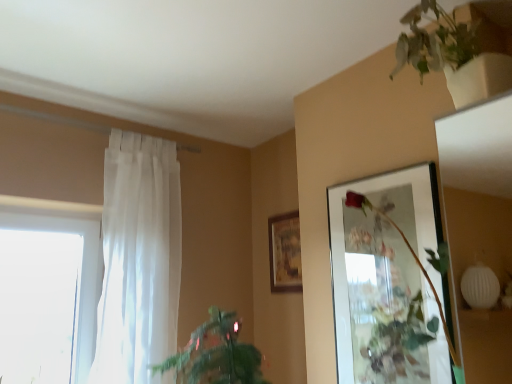
The height and width of the screenshot is (384, 512). What do you see at coordinates (452, 55) in the screenshot?
I see `green matte plant at upper right, which is the 2th houseplant from left to right` at bounding box center [452, 55].

What do you see at coordinates (389, 280) in the screenshot?
I see `matte glass picture frame at upper right, positioned as the 1th picture frame in front-to-back order` at bounding box center [389, 280].

Where is `green matte plant at upper right, which is the 2th houseplant from left to right`? The image size is (512, 384). green matte plant at upper right, which is the 2th houseplant from left to right is located at coordinates (452, 55).

Identify the location of houseplant below the wooden framed artwork at center, which is the 2th picture frame from right to left (from the image's perspective). This screenshot has height=384, width=512. (216, 354).

Considering the relative sizes of green leafy plant at lower left, which is the 1th houseplant from left to right, and wooden framed artwork at center, which is counted as the 2th picture frame, starting from the front, in the image provided, is green leafy plant at lower left, which is the 1th houseplant from left to right, thinner than wooden framed artwork at center, which is counted as the 2th picture frame, starting from the front,?

No.

Considering the relative positions of green leafy plant at lower left, which appears as the second houseplant when viewed from the right, and wooden framed artwork at center, which appears as the 1th picture frame when viewed from the left, in the image provided, is green leafy plant at lower left, which appears as the second houseplant when viewed from the right, to the right of wooden framed artwork at center, which appears as the 1th picture frame when viewed from the left, from the viewer's perspective?

In fact, green leafy plant at lower left, which appears as the second houseplant when viewed from the right, is to the left of wooden framed artwork at center, which appears as the 1th picture frame when viewed from the left.

In terms of width, does matte glass picture frame at upper right, the 2th picture frame in the back-to-front sequence, look wider or thinner when compared to green leafy plant at lower left, marked as the second houseplant in a top-to-bottom arrangement?

Considering their sizes, matte glass picture frame at upper right, the 2th picture frame in the back-to-front sequence, looks slimmer than green leafy plant at lower left, marked as the second houseplant in a top-to-bottom arrangement.

Looking at this image, between matte glass picture frame at upper right, positioned as the 1th picture frame in front-to-back order, and green leafy plant at lower left, which appears as the second houseplant when viewed from the right, which one has smaller size?

matte glass picture frame at upper right, positioned as the 1th picture frame in front-to-back order, is smaller.

Are matte glass picture frame at upper right, marked as the 1th picture frame in a right-to-left arrangement, and green leafy plant at lower left, positioned as the first houseplant in bottom-to-top order, located far from each other?

matte glass picture frame at upper right, marked as the 1th picture frame in a right-to-left arrangement, is near green leafy plant at lower left, positioned as the first houseplant in bottom-to-top order, not far away.

Considering the points (414, 208) and (277, 228), which point is in front, point (414, 208) or point (277, 228)?

The point (414, 208) is closer.

Is matte glass picture frame at upper right, marked as the 1th picture frame in a right-to-left arrangement, far away from wooden framed artwork at center, which is the 2th picture frame from right to left?

matte glass picture frame at upper right, marked as the 1th picture frame in a right-to-left arrangement, is actually quite close to wooden framed artwork at center, which is the 2th picture frame from right to left.

Would you say matte glass picture frame at upper right, marked as the 1th picture frame in a right-to-left arrangement, is inside or outside wooden framed artwork at center, which is the 2th picture frame from right to left?

matte glass picture frame at upper right, marked as the 1th picture frame in a right-to-left arrangement, lies outside wooden framed artwork at center, which is the 2th picture frame from right to left.

Between matte glass picture frame at upper right, marked as the 1th picture frame in a right-to-left arrangement, and wooden framed artwork at center, which appears as the 1th picture frame when viewed from the left, which one is positioned in front?

matte glass picture frame at upper right, marked as the 1th picture frame in a right-to-left arrangement, is in front.

Looking at their sizes, would you say green leafy plant at lower left, which appears as the second houseplant when viewed from the right, is wider or thinner than green matte plant at upper right, which is counted as the first houseplant, starting from the right?

Considering their sizes, green leafy plant at lower left, which appears as the second houseplant when viewed from the right, looks broader than green matte plant at upper right, which is counted as the first houseplant, starting from the right.

Considering the sizes of green leafy plant at lower left, which is the 1th houseplant from left to right, and green matte plant at upper right, arranged as the second houseplant when ordered from the bottom, in the image, is green leafy plant at lower left, which is the 1th houseplant from left to right, taller or shorter than green matte plant at upper right, arranged as the second houseplant when ordered from the bottom,?

Considering their sizes, green leafy plant at lower left, which is the 1th houseplant from left to right, has less height than green matte plant at upper right, arranged as the second houseplant when ordered from the bottom.

From a real-world perspective, is green leafy plant at lower left, positioned as the first houseplant in bottom-to-top order, on top of green matte plant at upper right, which appears as the first houseplant when viewed from the top?

No.

Is white sheer curtain at left far away from green leafy plant at lower left, which is the 1th houseplant from left to right?

white sheer curtain at left is near green leafy plant at lower left, which is the 1th houseplant from left to right, not far away.

Is white sheer curtain at left bigger than green leafy plant at lower left, which appears as the second houseplant when viewed from the right?

Yes, white sheer curtain at left is bigger than green leafy plant at lower left, which appears as the second houseplant when viewed from the right.

Is white sheer curtain at left not inside green leafy plant at lower left, which appears as the second houseplant when viewed from the right?

Indeed, white sheer curtain at left is completely outside green leafy plant at lower left, which appears as the second houseplant when viewed from the right.

The width and height of the screenshot is (512, 384). In the image, there is a white sheer curtain at left. Identify the location of houseplant below it (from a real-world perspective). (216, 354).

Is point (278, 215) closer or farther from the camera than point (425, 368)?

Point (278, 215) is positioned farther from the camera compared to point (425, 368).

Would you say wooden framed artwork at center, which appears as the 1th picture frame when viewed from the left, is a long distance from matte glass picture frame at upper right, positioned as the 1th picture frame in front-to-back order?

No.

Can you confirm if wooden framed artwork at center, which is counted as the 2th picture frame, starting from the front, is thinner than matte glass picture frame at upper right, the 2th picture frame in the back-to-front sequence?

Yes, wooden framed artwork at center, which is counted as the 2th picture frame, starting from the front, is thinner than matte glass picture frame at upper right, the 2th picture frame in the back-to-front sequence.

How many degrees apart are the facing directions of wooden framed artwork at center, which is counted as the first picture frame, starting from the back, and matte glass picture frame at upper right, marked as the 1th picture frame in a right-to-left arrangement?

The angular difference between wooden framed artwork at center, which is counted as the first picture frame, starting from the back, and matte glass picture frame at upper right, marked as the 1th picture frame in a right-to-left arrangement, is 0.853 degrees.

Is wooden framed artwork at center, which appears as the 1th picture frame when viewed from the left, next to white sheer curtain at left and touching it?

wooden framed artwork at center, which appears as the 1th picture frame when viewed from the left, and white sheer curtain at left are clearly separated.

Do you think wooden framed artwork at center, which is counted as the first picture frame, starting from the back, is within white sheer curtain at left, or outside of it?

The correct answer is: outside.

In the image, is wooden framed artwork at center, which is the 2th picture frame from right to left, on the left side or the right side of white sheer curtain at left?

wooden framed artwork at center, which is the 2th picture frame from right to left, is to the right of white sheer curtain at left.

Identify the location of houseplant on the left of wooden framed artwork at center, which is counted as the first picture frame, starting from the back. The height and width of the screenshot is (384, 512). (216, 354).

You are a GUI agent. You are given a task and a screenshot of the screen. Output one action in this format:
    pyautogui.click(x=<x>, y=<y>)
    Task: Click on the 1st houseplant in front of the matte glass picture frame at upper right, the 2th picture frame viewed from the left, counting from the anchor's position
    The image size is (512, 384).
    Given the screenshot: What is the action you would take?
    pyautogui.click(x=216, y=354)

From the image, which object appears to be farther from white sheer curtain at left, green leafy plant at lower left, marked as the second houseplant in a top-to-bottom arrangement, or matte glass picture frame at upper right, the 2th picture frame viewed from the left?

Based on the image, matte glass picture frame at upper right, the 2th picture frame viewed from the left, appears to be further to white sheer curtain at left.

Estimate the real-world distances between objects in this image. Which object is closer to wooden framed artwork at center, which appears as the 1th picture frame when viewed from the left, green matte plant at upper right, which is the 2th houseplant from left to right, or matte glass picture frame at upper right, marked as the 1th picture frame in a right-to-left arrangement?

Based on the image, matte glass picture frame at upper right, marked as the 1th picture frame in a right-to-left arrangement, appears to be nearer to wooden framed artwork at center, which appears as the 1th picture frame when viewed from the left.

From the image, which object appears to be farther from matte glass picture frame at upper right, the 2th picture frame viewed from the left, green leafy plant at lower left, marked as the second houseplant in a top-to-bottom arrangement, or wooden framed artwork at center, which is the 2th picture frame from right to left?

Among the two, wooden framed artwork at center, which is the 2th picture frame from right to left, is located further to matte glass picture frame at upper right, the 2th picture frame viewed from the left.

Looking at the image, which one is located further to green matte plant at upper right, which is the 2th houseplant from left to right, green leafy plant at lower left, which appears as the second houseplant when viewed from the right, or wooden framed artwork at center, which is the 2th picture frame from right to left?

wooden framed artwork at center, which is the 2th picture frame from right to left.

When comparing their distances from matte glass picture frame at upper right, the 2th picture frame viewed from the left, does green leafy plant at lower left, positioned as the first houseplant in bottom-to-top order, or white sheer curtain at left seem further?

Among the two, white sheer curtain at left is located further to matte glass picture frame at upper right, the 2th picture frame viewed from the left.

Based on their spatial positions, is white sheer curtain at left or wooden framed artwork at center, which is counted as the 2th picture frame, starting from the front, closer to green leafy plant at lower left, which is the 1th houseplant from left to right?

white sheer curtain at left is positioned closer to the anchor green leafy plant at lower left, which is the 1th houseplant from left to right.

Based on their spatial positions, is white sheer curtain at left or wooden framed artwork at center, which is the 2th picture frame from right to left, further from matte glass picture frame at upper right, positioned as the 1th picture frame in front-to-back order?

white sheer curtain at left.

When comparing their distances from matte glass picture frame at upper right, the 2th picture frame in the back-to-front sequence, does green leafy plant at lower left, which is the 1th houseplant from left to right, or green matte plant at upper right, which appears as the first houseplant when viewed from the top, seem further?

The object further to matte glass picture frame at upper right, the 2th picture frame in the back-to-front sequence, is green matte plant at upper right, which appears as the first houseplant when viewed from the top.

Locate an element on the screen. The image size is (512, 384). houseplant between white sheer curtain at left and matte glass picture frame at upper right, positioned as the 1th picture frame in front-to-back order is located at coordinates (216, 354).

Where is `houseplant between white sheer curtain at left and green matte plant at upper right, which is counted as the first houseplant, starting from the right`? houseplant between white sheer curtain at left and green matte plant at upper right, which is counted as the first houseplant, starting from the right is located at coordinates (216, 354).

Where is `houseplant between green matte plant at upper right, which is counted as the first houseplant, starting from the right, and wooden framed artwork at center, which is the 2th picture frame from right to left, from front to back`? This screenshot has width=512, height=384. houseplant between green matte plant at upper right, which is counted as the first houseplant, starting from the right, and wooden framed artwork at center, which is the 2th picture frame from right to left, from front to back is located at coordinates (216, 354).

I want to click on picture frame located between green matte plant at upper right, which appears as the first houseplant when viewed from the top, and wooden framed artwork at center, which appears as the 1th picture frame when viewed from the left, in the depth direction, so click(x=389, y=280).